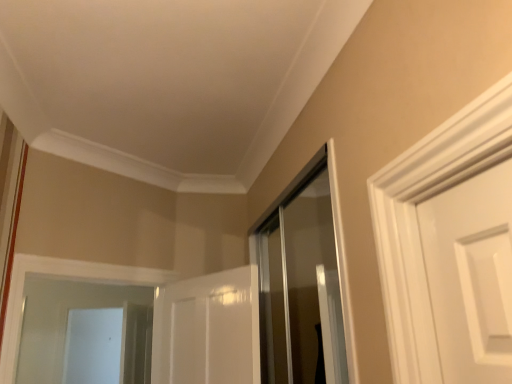
Question: Should I look upward or downward to see white glossy screen door at lower left?

Choices:
 (A) up
 (B) down

Answer: (B)

Question: From the image's perspective, does white glossy screen door at lower left appear higher than clear glass shower door at center?

Choices:
 (A) no
 (B) yes

Answer: (A)

Question: From a real-world perspective, does white glossy screen door at lower left sit lower than clear glass shower door at center?

Choices:
 (A) no
 (B) yes

Answer: (B)

Question: Can you confirm if white glossy screen door at lower left is shorter than clear glass shower door at center?

Choices:
 (A) no
 (B) yes

Answer: (A)

Question: Does white glossy screen door at lower left have a greater width compared to clear glass shower door at center?

Choices:
 (A) yes
 (B) no

Answer: (A)

Question: From a real-world perspective, does white glossy screen door at lower left stand above clear glass shower door at center?

Choices:
 (A) yes
 (B) no

Answer: (B)

Question: Is white glossy screen door at lower left outside clear glass shower door at center?

Choices:
 (A) yes
 (B) no

Answer: (A)

Question: Does clear glass shower door at center appear on the right side of white glossy screen door at lower left?

Choices:
 (A) yes
 (B) no

Answer: (A)

Question: Is clear glass shower door at center smaller than white glossy screen door at lower left?

Choices:
 (A) yes
 (B) no

Answer: (A)

Question: Is clear glass shower door at center at the left side of white glossy screen door at lower left?

Choices:
 (A) no
 (B) yes

Answer: (A)

Question: Considering the relative positions of clear glass shower door at center and white glossy screen door at lower left in the image provided, is clear glass shower door at center in front of white glossy screen door at lower left?

Choices:
 (A) no
 (B) yes

Answer: (B)

Question: Is clear glass shower door at center thinner than white glossy screen door at lower left?

Choices:
 (A) no
 (B) yes

Answer: (B)

Question: Can you confirm if clear glass shower door at center is taller than white glossy screen door at lower left?

Choices:
 (A) yes
 (B) no

Answer: (B)

Question: Considering the positions of white glossy screen door at lower left and clear glass shower door at center in the image, is white glossy screen door at lower left bigger or smaller than clear glass shower door at center?

Choices:
 (A) big
 (B) small

Answer: (A)